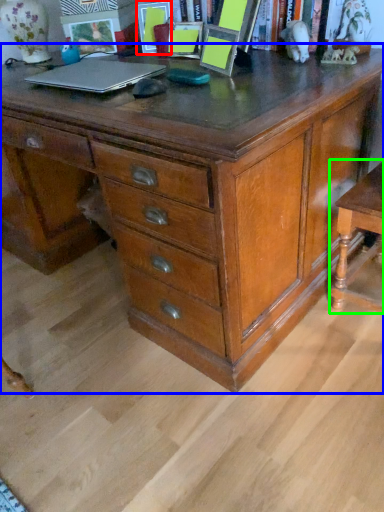
Question: Considering the real-world distances, which object is closest to picture frame (highlighted by a red box)? chest of drawers (highlighted by a blue box) or table (highlighted by a green box).

Choices:
 (A) chest of drawers
 (B) table

Answer: (A)